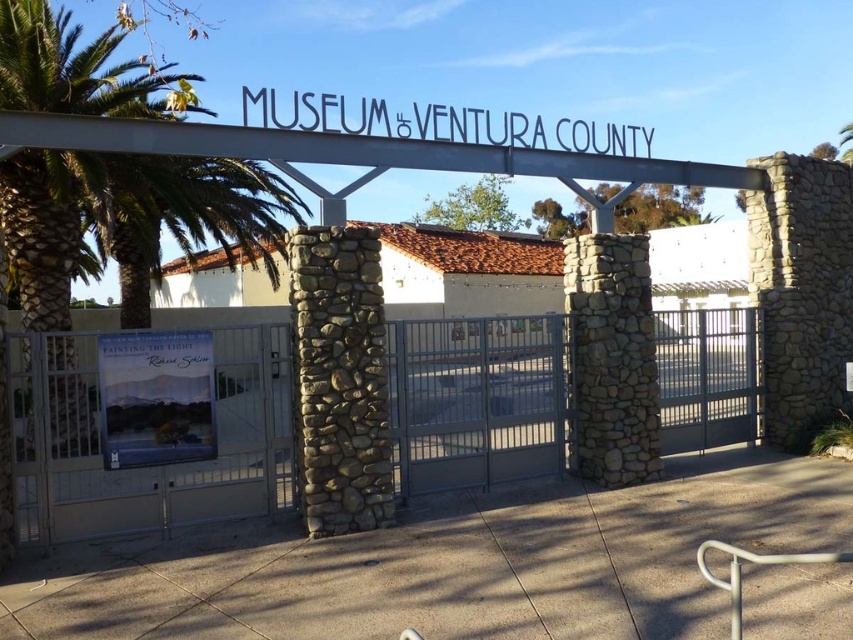
What is the spatial relationship between the metallic gray fence at center and the white metal sign at center in the Museum of Ventura County entrance?

The metallic gray fence at center is located to the left of the white metal sign at center.

You are at the entrance of the Museum of Ventura County and want to read the exhibition details. The entrance has a matte paper poster at center and a white metal sign at center. Which object is located lower?

The matte paper poster at center is positioned under the white metal sign at center, so it is located lower.

You are standing in front of the Museum of Ventura County entrance. You see a metallic gray fence at center and a matte paper poster at center. Which object is closer to you?

The metallic gray fence at center is closer to you because it is in front of the matte paper poster at center.